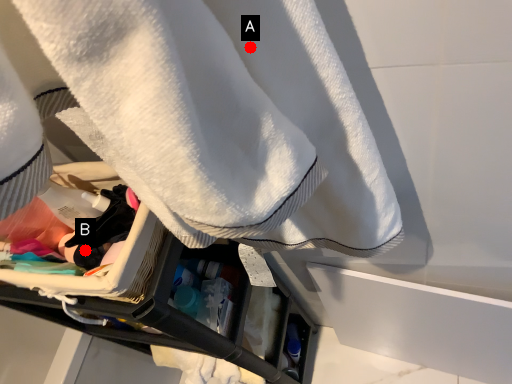
Question: Two points are circled on the image, labeled by A and B beside each circle. Which point is farther from the camera taking this photo?

Choices:
 (A) A is further
 (B) B is further

Answer: (B)